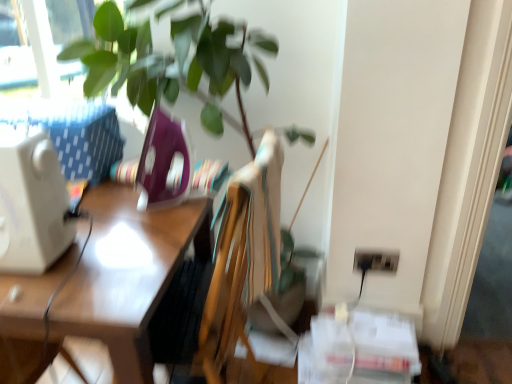
You are a GUI agent. You are given a task and a screenshot of the screen. Output one action in this format:
    pyautogui.click(x=<x>, y=<y>)
    Task: Click on the vacant space to the right of white plastic desktop computer at left
    The width and height of the screenshot is (512, 384).
    Given the screenshot: What is the action you would take?
    pyautogui.click(x=111, y=247)